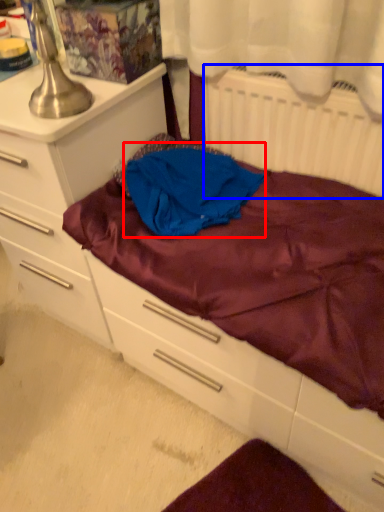
Question: Which object is closer to the camera taking this photo, clothing (highlighted by a red box) or radiator (highlighted by a blue box)?

Choices:
 (A) clothing
 (B) radiator

Answer: (B)